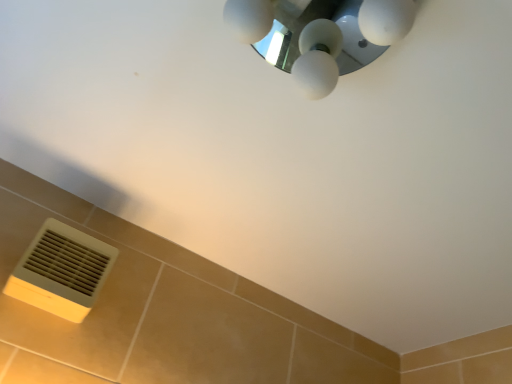
Describe the element at coordinates (61, 271) in the screenshot. Image resolution: width=512 pixels, height=384 pixels. I see `beige plastic air conditioning at lower left` at that location.

At what (x,y) coordinates should I click in order to perform the action: click on beige plastic air conditioning at lower left. Please return your answer as a coordinate pair (x, y). This screenshot has width=512, height=384. Looking at the image, I should click on (61, 271).

Measure the distance between point (x=24, y=254) and camera.

Point (x=24, y=254) is 35.71 inches away from camera.

This screenshot has height=384, width=512. In order to click on white glossy light fixture at upper center in this screenshot , I will do `click(319, 35)`.

The image size is (512, 384). What do you see at coordinates (319, 35) in the screenshot?
I see `white glossy light fixture at upper center` at bounding box center [319, 35].

Where is `beige plastic air conditioning at lower left`? The height and width of the screenshot is (384, 512). beige plastic air conditioning at lower left is located at coordinates (61, 271).

Based on their positions, is beige plastic air conditioning at lower left located to the left or right of white glossy light fixture at upper center?

Based on their positions, beige plastic air conditioning at lower left is located to the left of white glossy light fixture at upper center.

Based on the photo, is the position of beige plastic air conditioning at lower left less distant than that of white glossy light fixture at upper center?

No, it is behind white glossy light fixture at upper center.

Which is in front, point (66, 262) or point (343, 6)?

Point (66, 262)

From the picture: From the image's perspective, which one is positioned higher, beige plastic air conditioning at lower left or white glossy light fixture at upper center?

white glossy light fixture at upper center appears higher in the image.

From a real-world perspective, relative to white glossy light fixture at upper center, is beige plastic air conditioning at lower left vertically above or below?

Clearly, from a real-world perspective, beige plastic air conditioning at lower left is below white glossy light fixture at upper center.

Which object is thinner, beige plastic air conditioning at lower left or white glossy light fixture at upper center?

With smaller width is beige plastic air conditioning at lower left.

Considering the relative sizes of beige plastic air conditioning at lower left and white glossy light fixture at upper center in the image provided, is beige plastic air conditioning at lower left shorter than white glossy light fixture at upper center?

In fact, beige plastic air conditioning at lower left may be taller than white glossy light fixture at upper center.

Between beige plastic air conditioning at lower left and white glossy light fixture at upper center, which one has larger size?

white glossy light fixture at upper center is bigger.

Do you think beige plastic air conditioning at lower left is within white glossy light fixture at upper center, or outside of it?

beige plastic air conditioning at lower left is spatially situated outside white glossy light fixture at upper center.

Is beige plastic air conditioning at lower left touching white glossy light fixture at upper center?

No.

Is beige plastic air conditioning at lower left facing towards white glossy light fixture at upper center?

Yes, beige plastic air conditioning at lower left is oriented towards white glossy light fixture at upper center.

The height and width of the screenshot is (384, 512). What are the coordinates of `air conditioning lying below the white glossy light fixture at upper center (from the image's perspective)` in the screenshot? It's located at (61, 271).

Which is more to the right, white glossy light fixture at upper center or beige plastic air conditioning at lower left?

Positioned to the right is white glossy light fixture at upper center.

Is the position of white glossy light fixture at upper center more distant than that of beige plastic air conditioning at lower left?

No, white glossy light fixture at upper center is closer to the camera.

Considering the points (275, 28) and (54, 296), which point is in front, point (275, 28) or point (54, 296)?

The point (54, 296) is closer.

From the image's perspective, which one is positioned higher, white glossy light fixture at upper center or beige plastic air conditioning at lower left?

white glossy light fixture at upper center, from the image's perspective.

From a real-world perspective, is white glossy light fixture at upper center located beneath beige plastic air conditioning at lower left?

No.

Based on the photo, considering the sizes of white glossy light fixture at upper center and beige plastic air conditioning at lower left in the image, is white glossy light fixture at upper center wider or thinner than beige plastic air conditioning at lower left?

Considering their sizes, white glossy light fixture at upper center looks broader than beige plastic air conditioning at lower left.

In terms of height, does white glossy light fixture at upper center look taller or shorter compared to beige plastic air conditioning at lower left?

Considering their sizes, white glossy light fixture at upper center has less height than beige plastic air conditioning at lower left.

Based on their sizes in the image, would you say white glossy light fixture at upper center is bigger or smaller than beige plastic air conditioning at lower left?

Considering their sizes, white glossy light fixture at upper center takes up more space than beige plastic air conditioning at lower left.

Is white glossy light fixture at upper center situated inside beige plastic air conditioning at lower left or outside?

white glossy light fixture at upper center is not enclosed by beige plastic air conditioning at lower left.

Can you see white glossy light fixture at upper center touching beige plastic air conditioning at lower left?

They are not placed beside each other.

Is white glossy light fixture at upper center facing towards beige plastic air conditioning at lower left?

No, white glossy light fixture at upper center is not aimed at beige plastic air conditioning at lower left.

Can you tell me how much white glossy light fixture at upper center and beige plastic air conditioning at lower left differ in facing direction?

There is a 88.1-degree angle between the facing directions of white glossy light fixture at upper center and beige plastic air conditioning at lower left.

Identify the location of lamp that is on the right side of beige plastic air conditioning at lower left. This screenshot has width=512, height=384. (319, 35).

Where is `air conditioning on the left of white glossy light fixture at upper center`? air conditioning on the left of white glossy light fixture at upper center is located at coordinates (61, 271).

This screenshot has height=384, width=512. What are the coordinates of `air conditioning that is under the white glossy light fixture at upper center (from a real-world perspective)` in the screenshot? It's located at (61, 271).